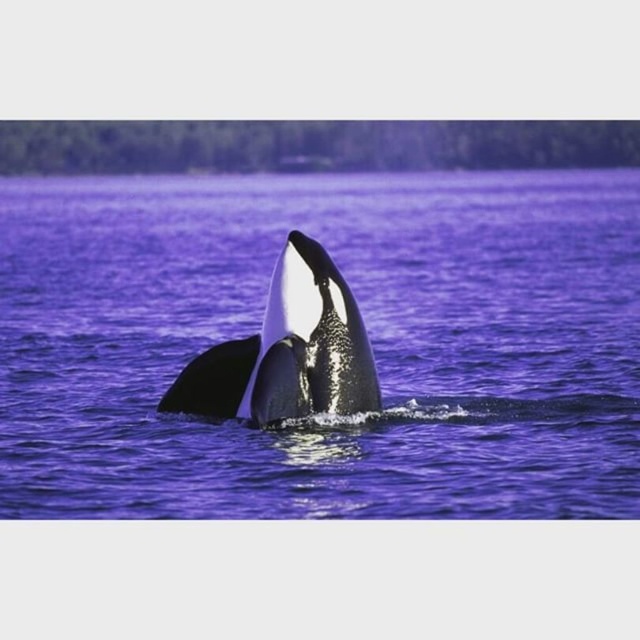
You are a marine biologist observing an orca breaching the water. In the image you see the purple water at center and the black smooth whale at center. Which object is closer to you, the observer?

The purple water at center is closer to you because it is in front of the black smooth whale at center.

You are a marine biologist observing an orca whale breaching the water. You notice the black smooth whale at center and the purple water at center. Based on their positions, which object is located to the right of the other?

The purple water at center is to the right of the black smooth whale at center.